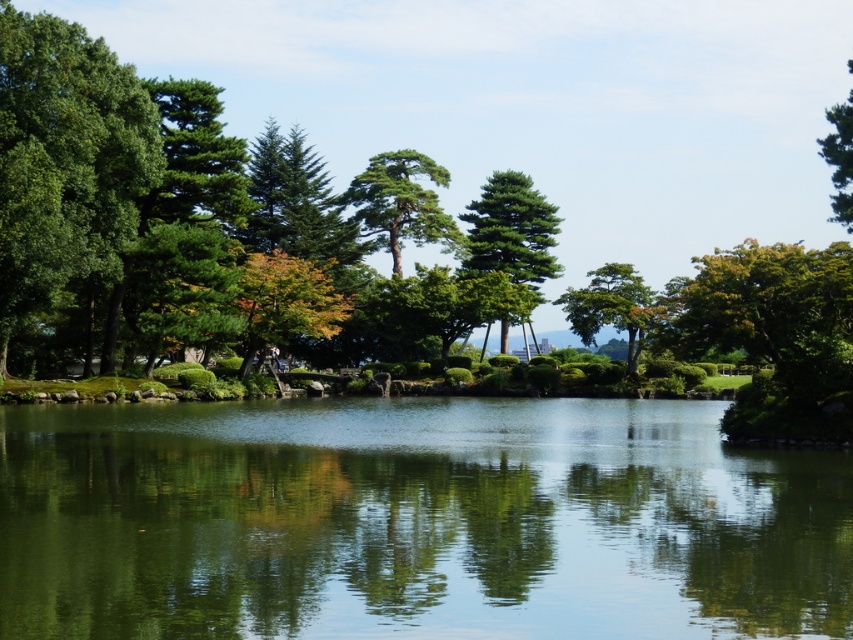
Is green textured pine tree at center thinner than green matte tree at upper right?

Yes.

Who is higher up, green textured pine tree at center or green matte tree at upper right?

green matte tree at upper right

Identify the location of green textured pine tree at center. The height and width of the screenshot is (640, 853). (401, 204).

The height and width of the screenshot is (640, 853). In order to click on green textured pine tree at center in this screenshot , I will do `click(401, 204)`.

Measure the distance between green reflective water at center and green matte tree at upper right.

green reflective water at center is 129.24 feet from green matte tree at upper right.

Looking at this image, is green reflective water at center to the left of green matte tree at upper right from the viewer's perspective?

Yes, green reflective water at center is to the left of green matte tree at upper right.

Where is `green reflective water at center`? Image resolution: width=853 pixels, height=640 pixels. green reflective water at center is located at coordinates (415, 522).

Does green reflective water at center appear under green glossy tree at center?

Yes, green reflective water at center is below green glossy tree at center.

Which is more to the left, green reflective water at center or green glossy tree at center?

green reflective water at center is more to the left.

Who is more forward, (183,630) or (578,333)?

Positioned in front is point (183,630).

Locate an element on the screen. The height and width of the screenshot is (640, 853). green reflective water at center is located at coordinates (415, 522).